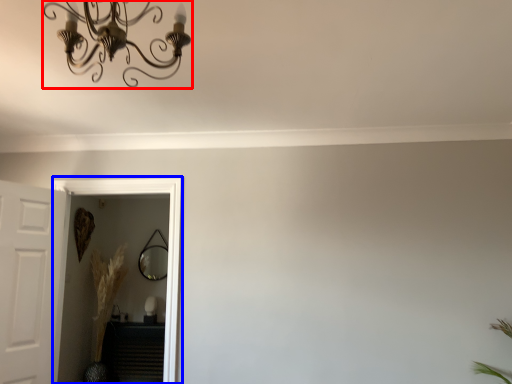
Question: Which point is closer to the camera, light fixture (highlighted by a red box) or glass door (highlighted by a blue box)?

Choices:
 (A) light fixture
 (B) glass door

Answer: (A)